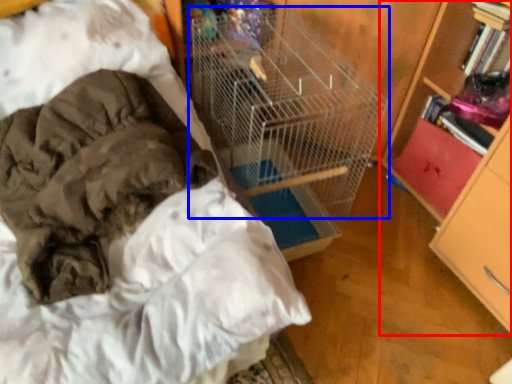
Question: Which object appears closest to the camera in this image, bookcase (highlighted by a red box) or bird cage (highlighted by a blue box)?

Choices:
 (A) bookcase
 (B) bird cage

Answer: (B)